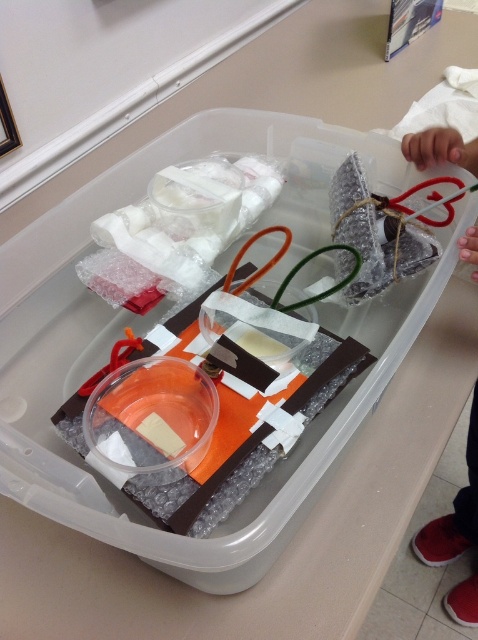
Question: Where is white bubble wrap at center located in relation to matte plastic heart at upper right in the image?

Choices:
 (A) below
 (B) above

Answer: (B)

Question: Can you confirm if white bubble wrap at center is smaller than matte plastic heart at upper right?

Choices:
 (A) no
 (B) yes

Answer: (B)

Question: Does white bubble wrap at center have a lesser width compared to matte plastic heart at upper right?

Choices:
 (A) no
 (B) yes

Answer: (A)